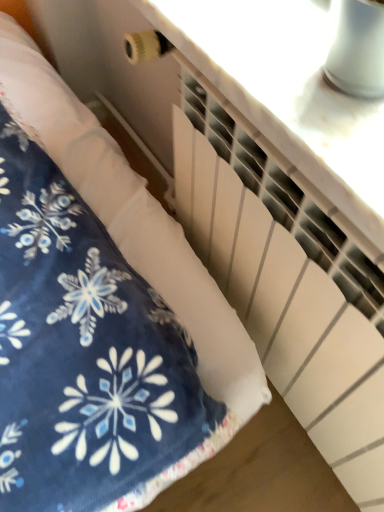
This screenshot has width=384, height=512. What are the coordinates of `white matte radiator at upper right` in the screenshot? It's located at (285, 89).

What do you see at coordinates (285, 89) in the screenshot? The width and height of the screenshot is (384, 512). I see `white matte radiator at upper right` at bounding box center [285, 89].

In order to click on white matte radiator at upper right in this screenshot , I will do `click(285, 89)`.